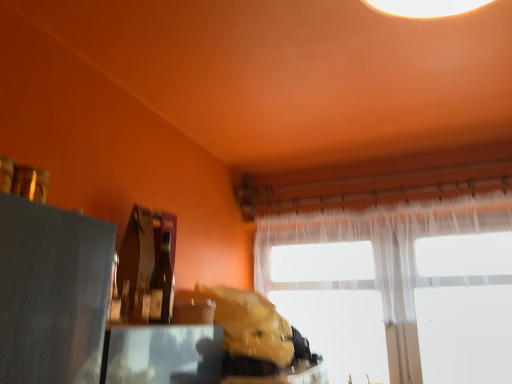
Where is `leather-like brown bag at center`? leather-like brown bag at center is located at coordinates (250, 324).

The height and width of the screenshot is (384, 512). What are the coordinates of `translucent fabric window at center` in the screenshot? It's located at (x=397, y=288).

Is point (139, 363) positioned after point (161, 322)?

No, (139, 363) is in front of (161, 322).

Is matte black table at lower left not inside matte glass bottle at center?

Absolutely, matte black table at lower left is external to matte glass bottle at center.

From the image's perspective, who appears lower, matte black table at lower left or matte glass bottle at center?

matte black table at lower left appears lower in the image.

Are translucent fabric window at center and leather-like brown bag at center far apart?

They are positioned close to each other.

Which object is further away from the camera, translucent fabric window at center or leather-like brown bag at center?

Positioned behind is translucent fabric window at center.

Is point (351, 212) positioned in front of point (259, 304)?

That is False.

Does translucent fabric window at center contain leather-like brown bag at center?

No, leather-like brown bag at center is not a part of translucent fabric window at center.

Measure the distance between leather-like brown bag at center and matte black table at lower left.

The distance of leather-like brown bag at center from matte black table at lower left is 32.83 centimeters.

Would you say leather-like brown bag at center is outside matte black table at lower left?

Yes, leather-like brown bag at center is outside of matte black table at lower left.

From the image's perspective, does leather-like brown bag at center appear higher than matte black table at lower left?

No, from the image's perspective, leather-like brown bag at center is not above matte black table at lower left.

Considering the points (285, 352) and (109, 329), which point is in front, point (285, 352) or point (109, 329)?

The point (109, 329) is closer to the camera.

Looking at the image, does matte black table at lower left seem bigger or smaller compared to translucent fabric window at center?

matte black table at lower left is smaller than translucent fabric window at center.

Does matte black table at lower left have a greater height compared to translucent fabric window at center?

In fact, matte black table at lower left may be shorter than translucent fabric window at center.

How different are the orientations of matte black table at lower left and translucent fabric window at center in degrees?

The facing directions of matte black table at lower left and translucent fabric window at center are 90.5 degrees apart.

Is translucent fabric window at center located within matte black table at lower left?

No, translucent fabric window at center is not inside matte black table at lower left.

Which of these two, matte black table at lower left or leather-like brown bag at center, is thinner?

Thinner between the two is matte black table at lower left.

Is matte black table at lower left facing towards leather-like brown bag at center?

No, matte black table at lower left is not oriented towards leather-like brown bag at center.

From the image's perspective, is matte black table at lower left above leather-like brown bag at center?

Yes, from the image's perspective, matte black table at lower left is over leather-like brown bag at center.

Is matte black table at lower left to the right of leather-like brown bag at center from the viewer's perspective?

Incorrect, matte black table at lower left is not on the right side of leather-like brown bag at center.

From a real-world perspective, which object stands above the other?

In real-world perspective, matte glass bottle at center is above.

Who is taller, translucent fabric window at center or matte glass bottle at center?

Standing taller between the two is translucent fabric window at center.

Is translucent fabric window at center bigger or smaller than matte glass bottle at center?

translucent fabric window at center is bigger than matte glass bottle at center.

From the image's perspective, is translucent fabric window at center beneath matte black table at lower left?

Yes, from the image's perspective, translucent fabric window at center is beneath matte black table at lower left.

Is translucent fabric window at center wider or thinner than matte black table at lower left?

Considering their sizes, translucent fabric window at center looks slimmer than matte black table at lower left.

Who is bigger, translucent fabric window at center or matte black table at lower left?

translucent fabric window at center.

Does point (327, 215) come farther from viewer compared to point (144, 381)?

Yes, it is behind point (144, 381).

Where is `bottle on the right of matte black table at lower left`? bottle on the right of matte black table at lower left is located at coordinates (162, 285).

At what (x,y) coordinates should I click in order to perform the action: click on window above the leather-like brown bag at center (from a real-world perspective). Please return your answer as a coordinate pair (x, y). The width and height of the screenshot is (512, 384). Looking at the image, I should click on (397, 288).

When comparing their distances from matte glass bottle at center, does translucent fabric window at center or leather-like brown bag at center seem closer?

leather-like brown bag at center lies closer to matte glass bottle at center than the other object.

Estimate the real-world distances between objects in this image. Which object is further from translucent fabric window at center, leather-like brown bag at center or matte glass bottle at center?

matte glass bottle at center is positioned further to the anchor translucent fabric window at center.

In the scene shown: Which object lies nearer to the anchor point matte black table at lower left, matte glass bottle at center or translucent fabric window at center?

Based on the image, matte glass bottle at center appears to be nearer to matte black table at lower left.

When comparing their distances from matte black table at lower left, does translucent fabric window at center or leather-like brown bag at center seem closer?

leather-like brown bag at center is positioned closer to the anchor matte black table at lower left.

Estimate the real-world distances between objects in this image. Which object is closer to leather-like brown bag at center, matte black table at lower left or translucent fabric window at center?

matte black table at lower left is positioned closer to the anchor leather-like brown bag at center.

Consider the image. From the image, which object appears to be farther from translucent fabric window at center, leather-like brown bag at center or matte black table at lower left?

matte black table at lower left lies further to translucent fabric window at center than the other object.

When comparing their distances from leather-like brown bag at center, does matte black table at lower left or matte glass bottle at center seem further?

matte glass bottle at center.

When comparing their distances from matte black table at lower left, does translucent fabric window at center or matte glass bottle at center seem further?

translucent fabric window at center is further to matte black table at lower left.

Find the location of a particular element. The height and width of the screenshot is (384, 512). animal between matte black table at lower left and translucent fabric window at center from front to back is located at coordinates (250, 324).

Identify the location of bottle situated between matte black table at lower left and translucent fabric window at center from left to right. (162, 285).

Identify the location of bottle positioned between matte black table at lower left and leather-like brown bag at center from near to far. (162, 285).

Find the location of a particular element. animal between matte glass bottle at center and translucent fabric window at center in the horizontal direction is located at coordinates (250, 324).